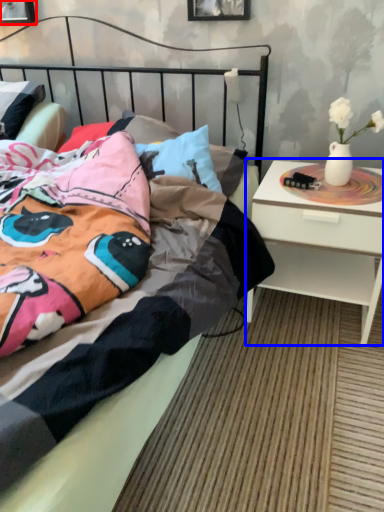
Question: Which object is further to the camera taking this photo, picture frame (highlighted by a red box) or nightstand (highlighted by a blue box)?

Choices:
 (A) picture frame
 (B) nightstand

Answer: (A)